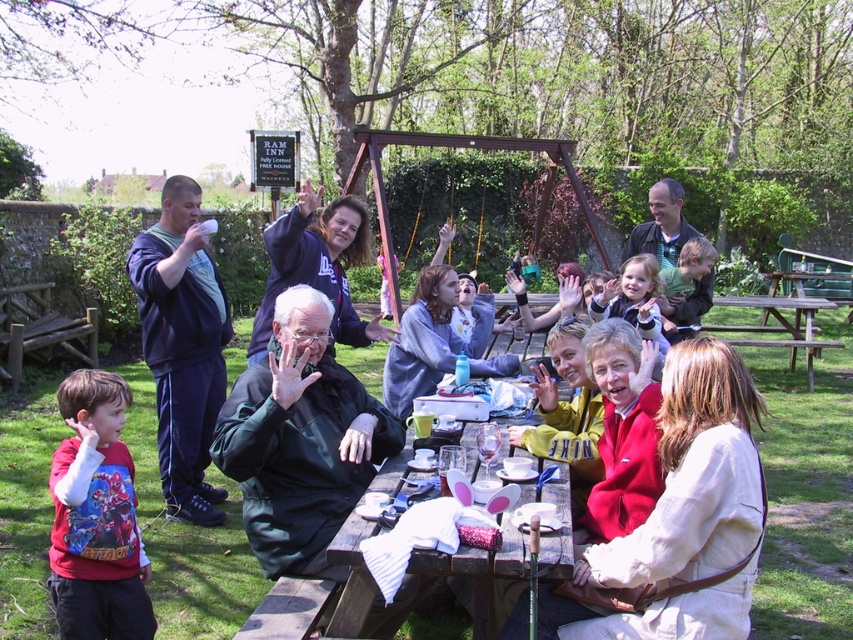
Question: Which point is closer to the camera?

Choices:
 (A) (558, 572)
 (B) (160, 342)

Answer: (A)

Question: Among these points, which one is nearest to the camera?

Choices:
 (A) (321, 442)
 (B) (514, 570)
 (C) (374, 474)

Answer: (B)

Question: Which of the following is the closest to the observer?

Choices:
 (A) brown wooden picnic table at center
 (B) dark blue tracksuit at left

Answer: (B)

Question: Does dark blue tracksuit at left appear over wooden picnic table at center?

Choices:
 (A) yes
 (B) no

Answer: (A)

Question: Can you confirm if green matte jacket at center is thinner than wooden picnic table at center?

Choices:
 (A) no
 (B) yes

Answer: (B)

Question: Can you confirm if wooden picnic table at center is bigger than brown wooden picnic table at center?

Choices:
 (A) yes
 (B) no

Answer: (B)